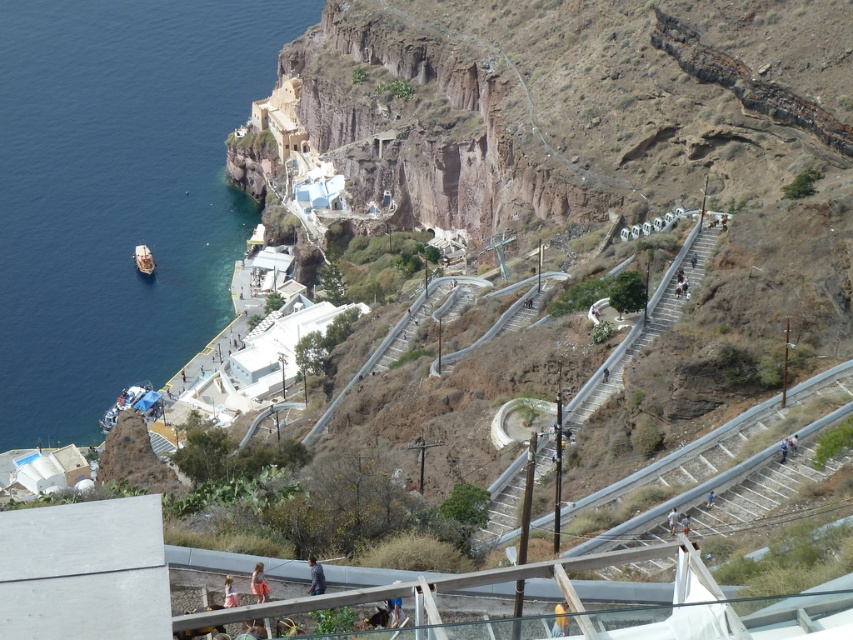
Question: Does yellow fabric at center appear over light brown fabric pants at center?

Choices:
 (A) no
 (B) yes

Answer: (A)

Question: Is yellow fabric at center above pink fabric skirt at lower center?

Choices:
 (A) no
 (B) yes

Answer: (B)

Question: Estimate the real-world distances between objects in this image. Which object is farther from the light brown wooden bench at center?

Choices:
 (A) pink fabric skirt at lower center
 (B) blue fabric bag at center
 (C) light blue fabric at center
 (D) white glossy boat at left

Answer: (D)

Question: Which point is closer to the camera?

Choices:
 (A) (142, 244)
 (B) (791, 442)
 (C) (683, 531)
 (D) (674, 520)

Answer: (C)

Question: Is white concrete stairs at center-right smaller than blue fabric bag at center?

Choices:
 (A) no
 (B) yes

Answer: (A)

Question: Which point is closer to the camera taking this photo?

Choices:
 (A) (668, 284)
 (B) (786, 448)
 (C) (560, 628)

Answer: (C)